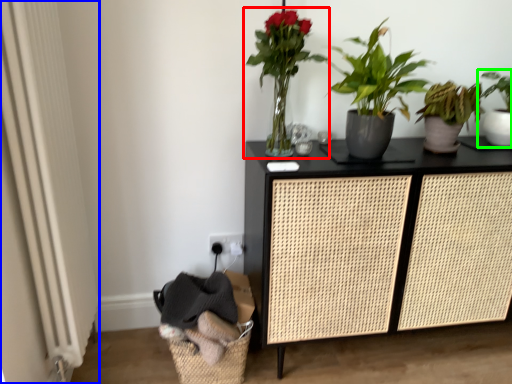
Question: Estimate the real-world distances between objects in this image. Which object is closer to houseplant (highlighted by a red box), screen door (highlighted by a blue box) or houseplant (highlighted by a green box)?

Choices:
 (A) screen door
 (B) houseplant

Answer: (A)